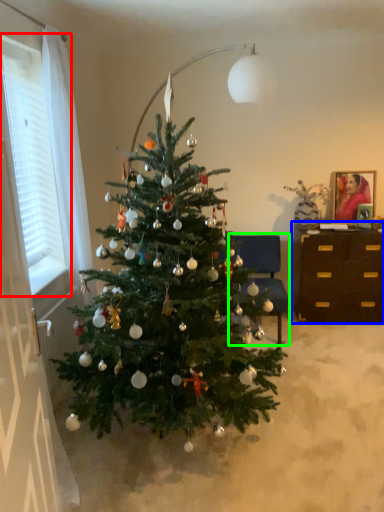
Question: Which object is the closest to the window (highlighted by a red box)? Choose among these: desk (highlighted by a blue box) or armchair (highlighted by a green box).

Choices:
 (A) desk
 (B) armchair

Answer: (B)